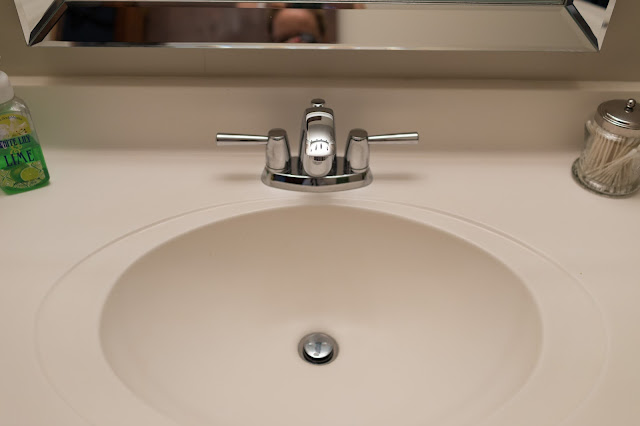
I want to click on mirror, so click(x=572, y=29), click(x=105, y=24).